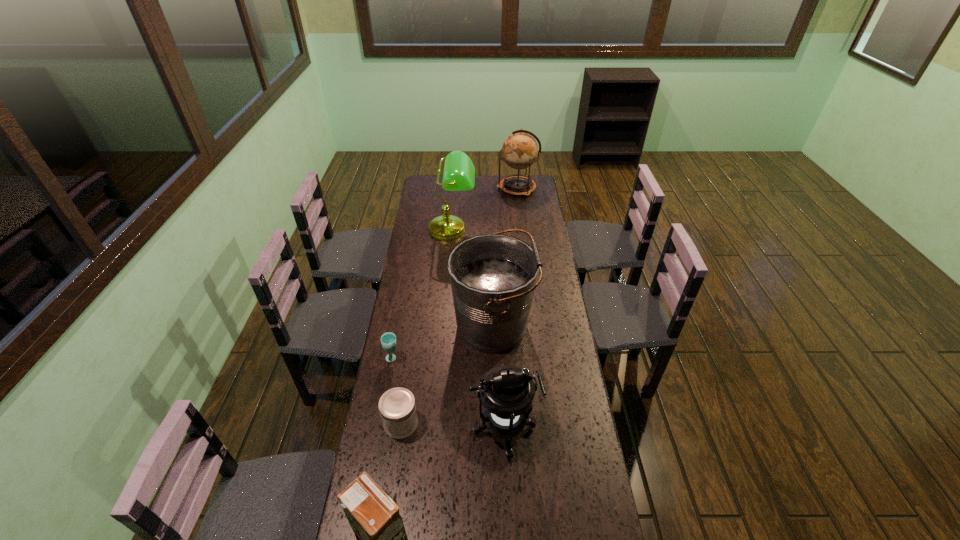
Where is `object that is at the far right corner`? object that is at the far right corner is located at coordinates (519, 150).

In the image, there is a desktop. What are the coordinates of `vacant space at the far edge` in the screenshot? It's located at (495, 194).

The width and height of the screenshot is (960, 540). In the image, there is a desktop. In order to click on vacant area at the left edge in this screenshot , I will do `click(444, 197)`.

Identify the location of free space at the right edge. Image resolution: width=960 pixels, height=540 pixels. (562, 416).

The image size is (960, 540). In the image, there is a desktop. Identify the location of free space at the far left corner. (428, 183).

This screenshot has width=960, height=540. I want to click on unoccupied position between the jar and the lantern, so click(453, 427).

Where is `empty space that is in between the jar and the bucket`? The height and width of the screenshot is (540, 960). empty space that is in between the jar and the bucket is located at coordinates (446, 375).

Where is `the fourth closest object to the glass`? The image size is (960, 540). the fourth closest object to the glass is located at coordinates (373, 516).

Identify which object is located as the fifth nearest to the globe. Please provide its 2D coordinates. Your answer should be formatted as a tuple, i.e. [(x, y)], where the tuple contains the x and y coordinates of a point satisfying the conditions above.

[(397, 407)]

This screenshot has width=960, height=540. I want to click on free space that satisfies the following two spatial constraints: 1. on the front side of the lantern; 2. on the right side of the glass, so click(x=379, y=430).